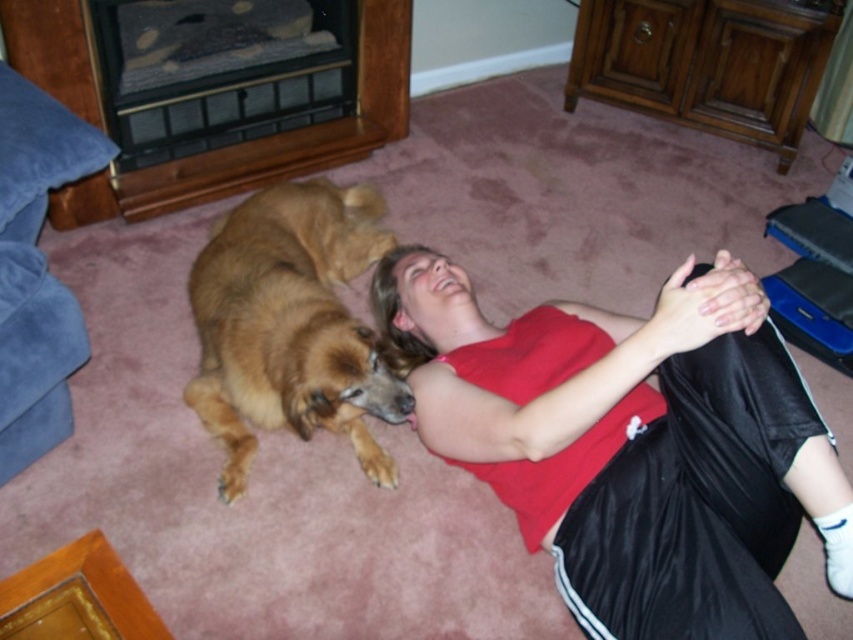
Between point (648, 371) and point (338, 364), which one is positioned in front?

Point (648, 371)

Is matte red tank top at center further to camera compared to golden fur dog at center?

No, matte red tank top at center is closer to the viewer.

The width and height of the screenshot is (853, 640). What do you see at coordinates (630, 442) in the screenshot? I see `matte red tank top at center` at bounding box center [630, 442].

You are a GUI agent. You are given a task and a screenshot of the screen. Output one action in this format:
    pyautogui.click(x=<x>, y=<y>)
    Task: Click on the matte red tank top at center
    The width and height of the screenshot is (853, 640).
    Given the screenshot: What is the action you would take?
    (630, 442)